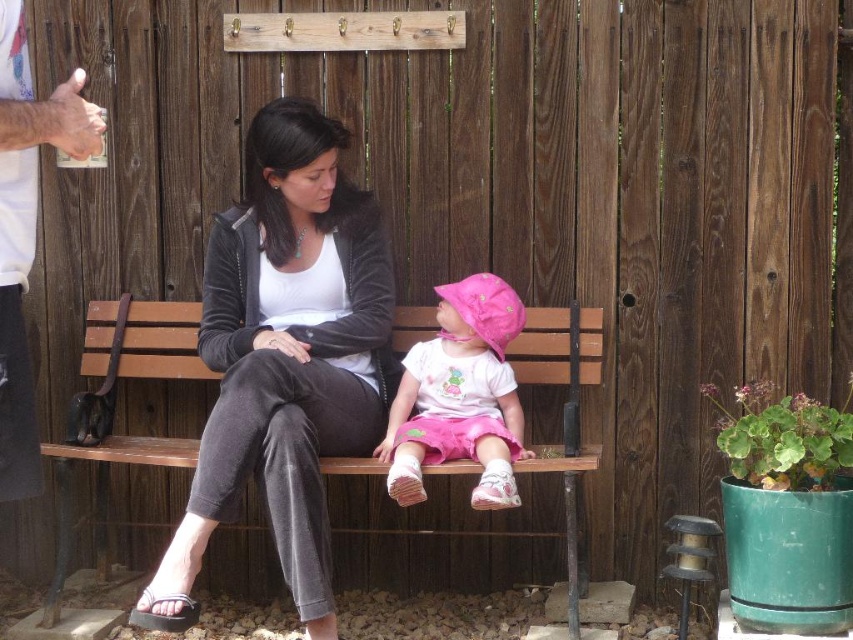
Who is more distant from viewer, (271, 451) or (531, 330)?

Positioned behind is point (531, 330).

Based on the photo, does velvet black jacket at center appear on the left side of wooden bench at center?

Correct, you'll find velvet black jacket at center to the left of wooden bench at center.

What do you see at coordinates (289, 349) in the screenshot?
I see `velvet black jacket at center` at bounding box center [289, 349].

The height and width of the screenshot is (640, 853). I want to click on velvet black jacket at center, so click(x=289, y=349).

Is point (518, 371) positioned in front of point (444, 440)?

No, it is not.

Between wooden bench at center and pink fabric hat at center, which one is positioned lower?

wooden bench at center is lower down.

Is point (569, 435) behind point (457, 326)?

No.

Find the location of `wooden bench at center`. wooden bench at center is located at coordinates (561, 428).

Who is lower down, black fabric pants at center or gray fabric sandal at lower left?

gray fabric sandal at lower left is lower down.

Between point (355, 396) and point (184, 596), which one is positioned behind?

The point (355, 396) is behind.

Identify the location of black fabric pants at center. (292, 406).